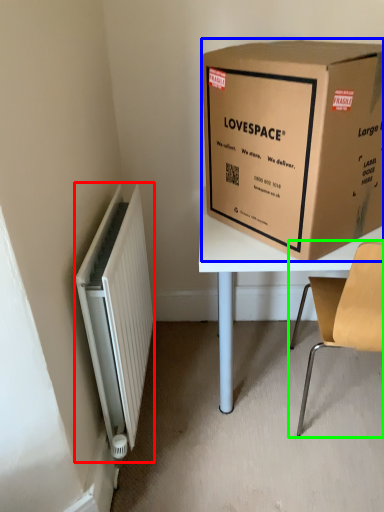
Question: Considering the real-world distances, which object is closest to radiator (highlighted by a red box)? box (highlighted by a blue box) or chair (highlighted by a green box).

Choices:
 (A) box
 (B) chair

Answer: (A)